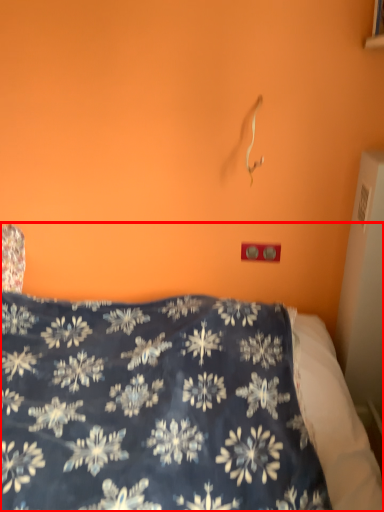
Question: From the image's perspective, where is bed (annotated by the red box) located in relation to electric outlet in the image?

Choices:
 (A) above
 (B) below

Answer: (B)